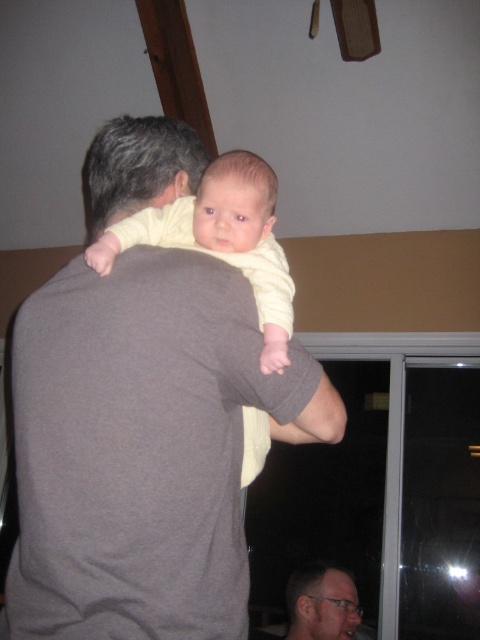
You are a photographer setting up a shoot in a room with a sliding glass door at night. You have two subjects to photograph. The first is the gray cotton shirt at upper left, and the second is the yellow soft fabric baby at center. If you want to focus on the subject that is closer to the camera, which one should you choose?

The gray cotton shirt at upper left is much taller than the yellow soft fabric baby at center, so focusing on the gray cotton shirt at upper left would be closer to the camera.

You are a photographer setting up a studio. You have two gray shirts, the gray cotton shirt at upper left and the matte gray shirt at center, that need to be placed on a rack. The rack can only hold items within 6 feet of each other. Can both shirts be placed on the rack without moving them?

The distance between the gray cotton shirt at upper left and the matte gray shirt at center is 6.11 feet, which exceeds the 6 feet limit. Therefore, they cannot both be placed on the rack without moving at least one of them.

You are an interior designer observing the scene. You need to place a decorative shelf between the gray cotton shirt at upper left and the matte gray shirt at center. Which shirt should the shelf be placed closer to if the shelf must be closer to the taller object?

The gray cotton shirt at upper left is taller than the matte gray shirt at center, so the shelf should be placed closer to the gray cotton shirt at upper left.